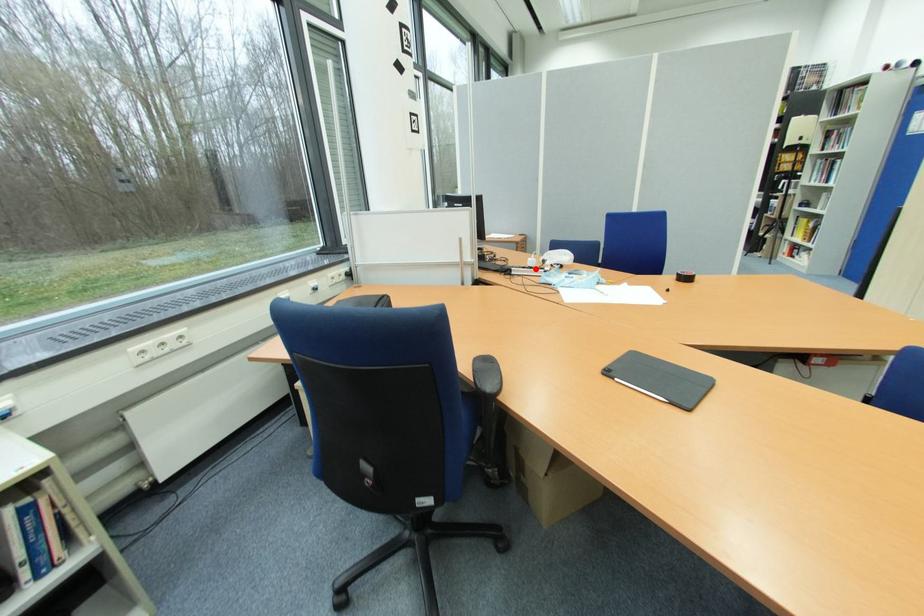
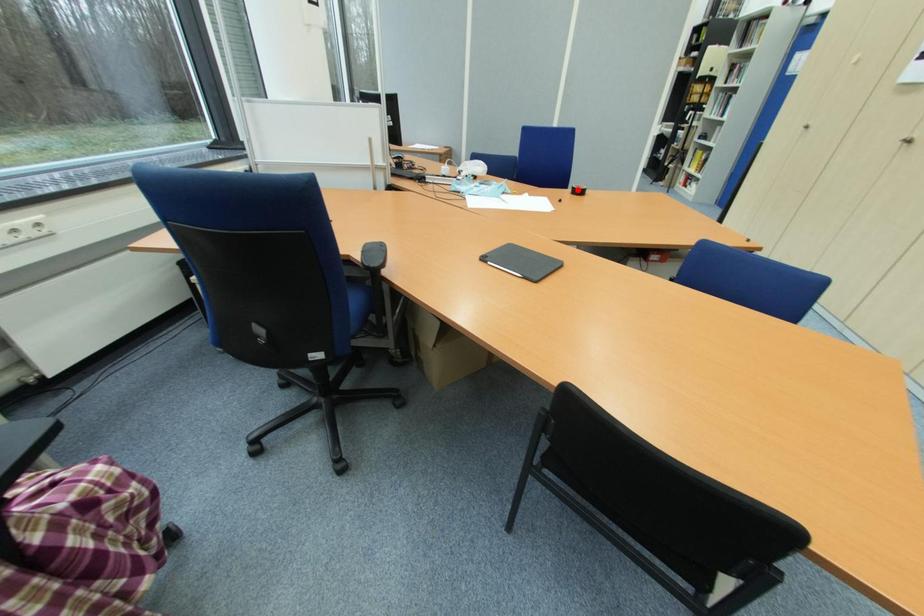
I am providing you with two images of the same scene from different viewpoints. A red point is marked on the first image and another point is marked on the second image. Do the highlighted points in image1 and image2 indicate the same real-world spot?

No